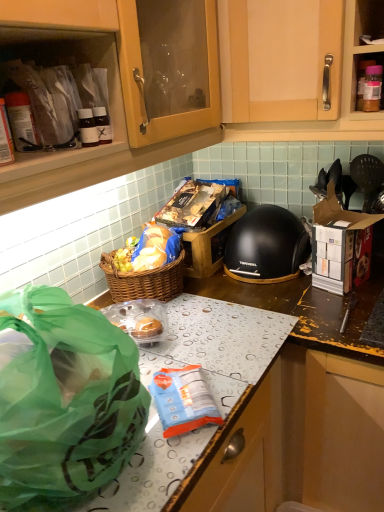
Identify the location of vacant region in front of blue plastic bag at center. (150, 470).